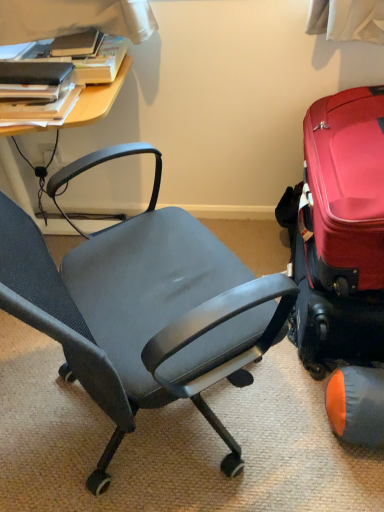
What is the approximate height of shiny red suitcase at right?

16.00 inches.

This screenshot has height=512, width=384. What do you see at coordinates (34, 90) in the screenshot?
I see `matte black book at upper left, which is the second book in top-to-bottom order` at bounding box center [34, 90].

Where is `shiny red suitcase at right`? shiny red suitcase at right is located at coordinates (340, 230).

Between hardcover book at upper left, which is counted as the 1th book, starting from the top, and orange fabric bean bag chair at lower right, which one has larger size?

Bigger between the two is hardcover book at upper left, which is counted as the 1th book, starting from the top.

Considering the points (102, 63) and (378, 383), which point is in front, point (102, 63) or point (378, 383)?

The point (378, 383) is more forward.

Which object is closer to the camera, hardcover book at upper left, which is counted as the 1th book, starting from the top, or orange fabric bean bag chair at lower right?

orange fabric bean bag chair at lower right is closer to the camera.

Could you measure the distance between shiny red suitcase at right and matte black book at upper left, arranged as the 1th book when ordered from the bottom?

shiny red suitcase at right is 33.65 inches away from matte black book at upper left, arranged as the 1th book when ordered from the bottom.

The width and height of the screenshot is (384, 512). In order to click on the 1st book behind the shiny red suitcase at right in this screenshot , I will do 34,90.

Does shiny red suitcase at right appear on the left side of matte black book at upper left, arranged as the 1th book when ordered from the bottom?

In fact, shiny red suitcase at right is to the right of matte black book at upper left, arranged as the 1th book when ordered from the bottom.

Is shiny red suitcase at right oriented away from matte black book at upper left, arranged as the 1th book when ordered from the bottom?

That's not correct — shiny red suitcase at right is not looking away from matte black book at upper left, arranged as the 1th book when ordered from the bottom.

What's the angular difference between shiny red suitcase at right and orange fabric bean bag chair at lower right's facing directions?

They differ by 1.66 degrees in their facing directions.

Would you consider shiny red suitcase at right to be distant from orange fabric bean bag chair at lower right?

No.

How far apart are shiny red suitcase at right and orange fabric bean bag chair at lower right?

shiny red suitcase at right is 14.27 inches from orange fabric bean bag chair at lower right.

Considering the sizes of objects shiny red suitcase at right and orange fabric bean bag chair at lower right in the image provided, who is shorter, shiny red suitcase at right or orange fabric bean bag chair at lower right?

orange fabric bean bag chair at lower right is shorter.

Locate an element on the screen. bean bag chair that appears on the left of shiny red suitcase at right is located at coordinates (357, 405).

Can you tell me how much orange fabric bean bag chair at lower right and shiny red suitcase at right differ in facing direction?

The angular difference between orange fabric bean bag chair at lower right and shiny red suitcase at right is 1.66 degrees.

From the picture: Is orange fabric bean bag chair at lower right positioned beyond the bounds of shiny red suitcase at right?

orange fabric bean bag chair at lower right lies outside shiny red suitcase at right's area.

You are a GUI agent. You are given a task and a screenshot of the screen. Output one action in this format:
    pyautogui.click(x=<x>, y=<y>)
    Task: Click on the book on the right of matte black book at upper left, which is the second book in top-to-bottom order
    The height and width of the screenshot is (512, 384).
    Given the screenshot: What is the action you would take?
    pyautogui.click(x=83, y=59)

Which object is further away from the camera, hardcover book at upper left, which appears as the second book when ordered from the bottom, or matte black book at upper left, arranged as the 1th book when ordered from the bottom?

hardcover book at upper left, which appears as the second book when ordered from the bottom, is further from the camera.

Which is more to the right, hardcover book at upper left, which appears as the second book when ordered from the bottom, or matte black book at upper left, which is the second book in top-to-bottom order?

Positioned to the right is hardcover book at upper left, which appears as the second book when ordered from the bottom.

Between orange fabric bean bag chair at lower right and matte black book at upper left, arranged as the 1th book when ordered from the bottom, which one has larger size?

orange fabric bean bag chair at lower right.

Which is behind, orange fabric bean bag chair at lower right or matte black book at upper left, which is the second book in top-to-bottom order?

matte black book at upper left, which is the second book in top-to-bottom order, is further away from the camera.

Does point (366, 426) come closer to viewer compared to point (30, 95)?

Yes.

Based on the photo, is orange fabric bean bag chair at lower right facing away from matte black book at upper left, which is the second book in top-to-bottom order?

No, orange fabric bean bag chair at lower right's orientation is not away from matte black book at upper left, which is the second book in top-to-bottom order.

Is the surface of shiny red suitcase at right in direct contact with hardcover book at upper left, which is counted as the 1th book, starting from the top?

There is a gap between shiny red suitcase at right and hardcover book at upper left, which is counted as the 1th book, starting from the top.

Which of these two, shiny red suitcase at right or hardcover book at upper left, which appears as the second book when ordered from the bottom, is bigger?

shiny red suitcase at right.

Is shiny red suitcase at right not inside hardcover book at upper left, which is counted as the 1th book, starting from the top?

shiny red suitcase at right lies outside hardcover book at upper left, which is counted as the 1th book, starting from the top,'s area.

In terms of width, does shiny red suitcase at right look wider or thinner when compared to hardcover book at upper left, which appears as the second book when ordered from the bottom?

shiny red suitcase at right is wider than hardcover book at upper left, which appears as the second book when ordered from the bottom.

The height and width of the screenshot is (512, 384). What are the coordinates of `bean bag chair located below the hardcover book at upper left, which appears as the second book when ordered from the bottom (from the image's perspective)` in the screenshot? It's located at (357, 405).

In order to click on suitcase below the matte black book at upper left, arranged as the 1th book when ordered from the bottom (from a real-world perspective) in this screenshot , I will do `click(340, 230)`.

Looking at the image, which one is located closer to orange fabric bean bag chair at lower right, matte black book at upper left, which is the second book in top-to-bottom order, or hardcover book at upper left, which is counted as the 1th book, starting from the top?

matte black book at upper left, which is the second book in top-to-bottom order, lies closer to orange fabric bean bag chair at lower right than the other object.

Consider the image. Looking at the image, which one is located closer to matte black book at upper left, which is the second book in top-to-bottom order, shiny red suitcase at right or orange fabric bean bag chair at lower right?

shiny red suitcase at right is closer to matte black book at upper left, which is the second book in top-to-bottom order.

Considering their positions, is hardcover book at upper left, which is counted as the 1th book, starting from the top, positioned closer to shiny red suitcase at right than orange fabric bean bag chair at lower right?

orange fabric bean bag chair at lower right.

Considering their positions, is orange fabric bean bag chair at lower right positioned closer to matte black book at upper left, arranged as the 1th book when ordered from the bottom, than hardcover book at upper left, which is counted as the 1th book, starting from the top?

Based on the image, hardcover book at upper left, which is counted as the 1th book, starting from the top, appears to be nearer to matte black book at upper left, arranged as the 1th book when ordered from the bottom.

Considering their positions, is hardcover book at upper left, which is counted as the 1th book, starting from the top, positioned further to matte black book at upper left, arranged as the 1th book when ordered from the bottom, than orange fabric bean bag chair at lower right?

Among the two, orange fabric bean bag chair at lower right is located further to matte black book at upper left, arranged as the 1th book when ordered from the bottom.

Estimate the real-world distances between objects in this image. Which object is further from hardcover book at upper left, which appears as the second book when ordered from the bottom, shiny red suitcase at right or matte black book at upper left, arranged as the 1th book when ordered from the bottom?

Based on the image, shiny red suitcase at right appears to be further to hardcover book at upper left, which appears as the second book when ordered from the bottom.

Estimate the real-world distances between objects in this image. Which object is closer to hardcover book at upper left, which appears as the second book when ordered from the bottom, orange fabric bean bag chair at lower right or shiny red suitcase at right?

Based on the image, shiny red suitcase at right appears to be nearer to hardcover book at upper left, which appears as the second book when ordered from the bottom.

From the image, which object appears to be farther from hardcover book at upper left, which is counted as the 1th book, starting from the top, matte black book at upper left, arranged as the 1th book when ordered from the bottom, or shiny red suitcase at right?

Based on the image, shiny red suitcase at right appears to be further to hardcover book at upper left, which is counted as the 1th book, starting from the top.

Image resolution: width=384 pixels, height=512 pixels. What are the coordinates of `book between hardcover book at upper left, which is counted as the 1th book, starting from the top, and orange fabric bean bag chair at lower right in the up-down direction` in the screenshot? It's located at (34, 90).

Where is `bean bag chair between matte black book at upper left, arranged as the 1th book when ordered from the bottom, and shiny red suitcase at right`? The width and height of the screenshot is (384, 512). bean bag chair between matte black book at upper left, arranged as the 1th book when ordered from the bottom, and shiny red suitcase at right is located at coordinates (357, 405).

You are a GUI agent. You are given a task and a screenshot of the screen. Output one action in this format:
    pyautogui.click(x=<x>, y=<y>)
    Task: Click on the book between matte black book at upper left, which is the second book in top-to-bottom order, and shiny red suitcase at right from left to right
    The width and height of the screenshot is (384, 512).
    Given the screenshot: What is the action you would take?
    point(83,59)

I want to click on suitcase that lies between hardcover book at upper left, which is counted as the 1th book, starting from the top, and orange fabric bean bag chair at lower right from top to bottom, so click(x=340, y=230).